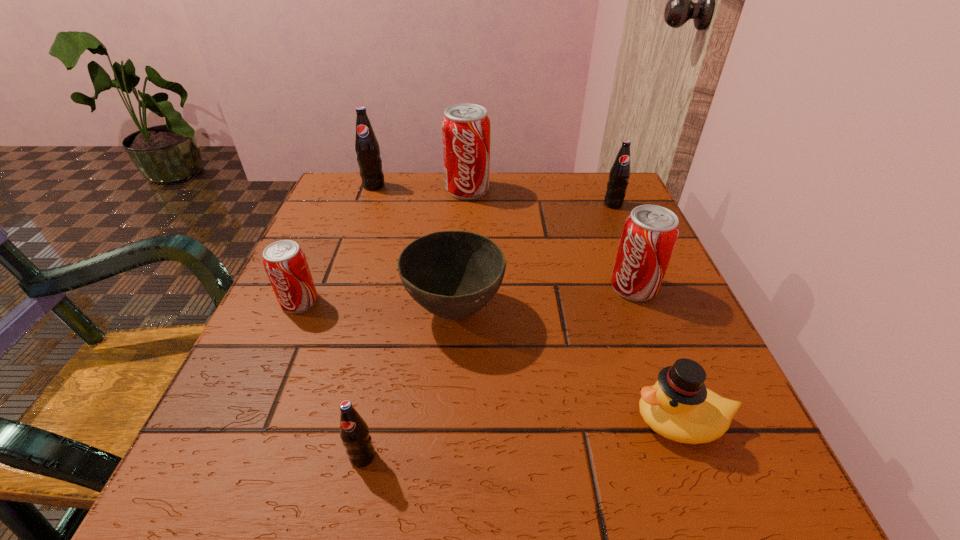
Image resolution: width=960 pixels, height=540 pixels. In order to click on vacant region that satisfies the following two spatial constraints: 1. on the front label of the farthest black pop; 2. on the right side of the biggest red soda can in this screenshot , I will do 372,190.

Identify the location of vacant region that satisfies the following two spatial constraints: 1. on the front label of the second farthest black pop; 2. on the front-facing side of the duck. Image resolution: width=960 pixels, height=540 pixels. (706, 421).

Where is `vacant space that satisfies the following two spatial constraints: 1. on the front-facing side of the duck; 2. on the front label of the nearest black pop`? vacant space that satisfies the following two spatial constraints: 1. on the front-facing side of the duck; 2. on the front label of the nearest black pop is located at coordinates (694, 457).

Image resolution: width=960 pixels, height=540 pixels. Find the location of `free point that satisfies the following two spatial constraints: 1. on the front label of the second biggest red soda can; 2. on the left side of the biggest black pop`. free point that satisfies the following two spatial constraints: 1. on the front label of the second biggest red soda can; 2. on the left side of the biggest black pop is located at coordinates (337, 287).